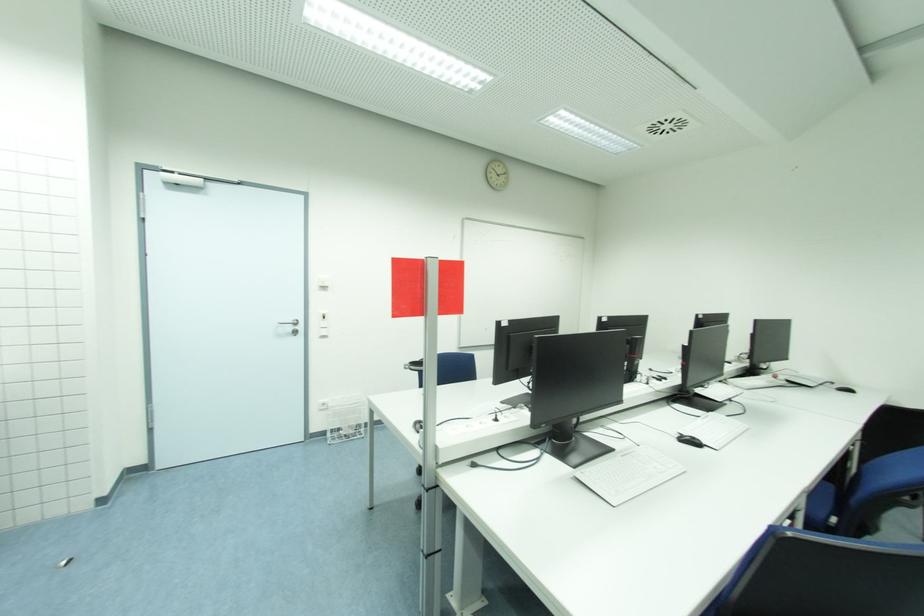
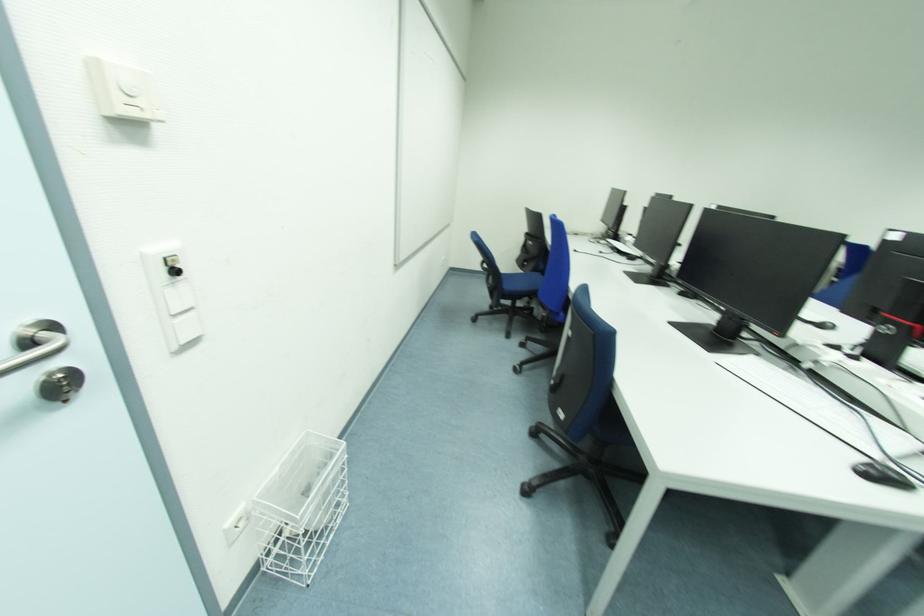
The point at [329,432] is marked in the first image. Where is the corresponding point in the second image?

(261, 564)